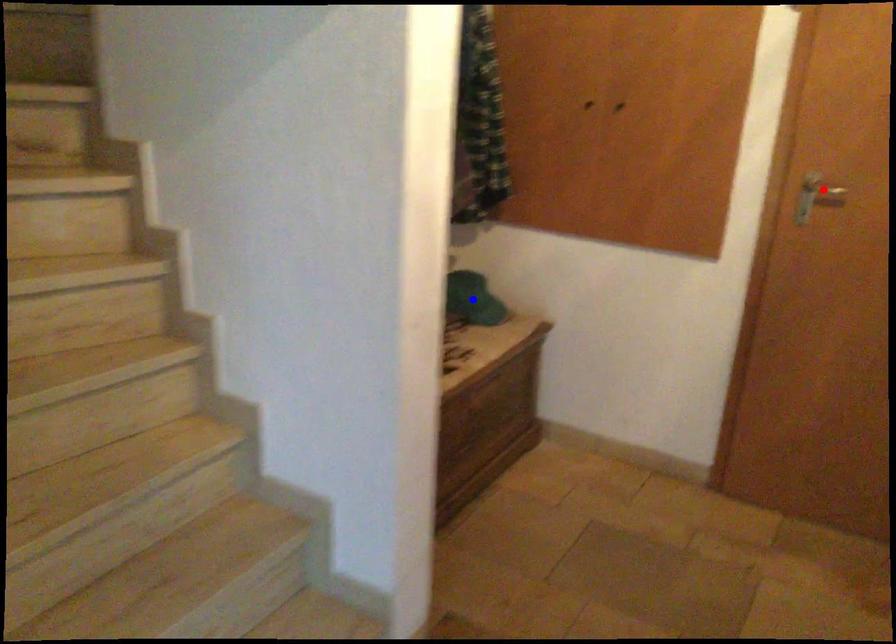
Question: In the image, two points are highlighted. Which point is nearer to the camera? Reply with the corresponding letter.

Choices:
 (A) blue point
 (B) red point

Answer: (B)